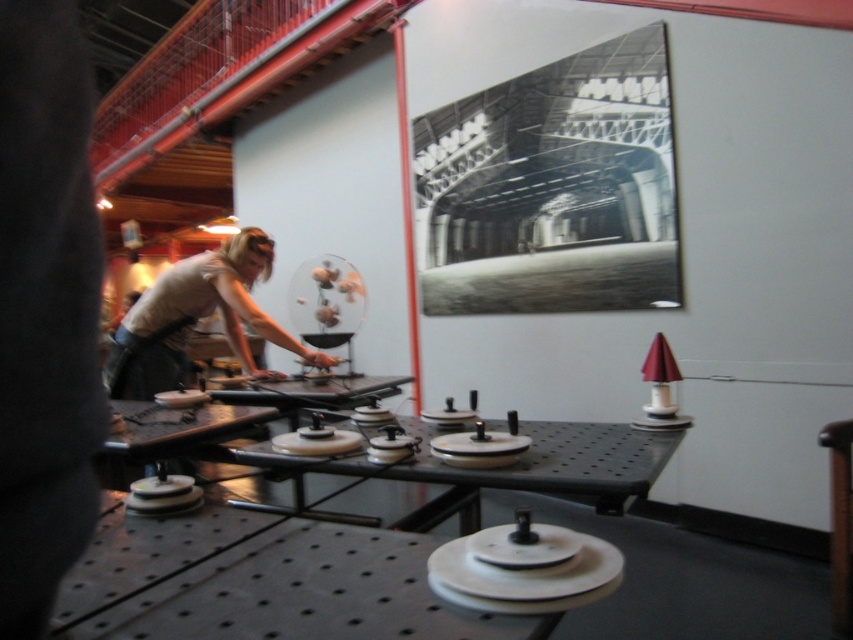
Question: Can you confirm if metallic industrial structure at upper center is bigger than light beige fabric shirt at left?

Choices:
 (A) no
 (B) yes

Answer: (B)

Question: Can you confirm if metallic industrial structure at upper center is positioned to the left of light beige fabric shirt at left?

Choices:
 (A) no
 (B) yes

Answer: (A)

Question: Among these objects, which one is nearest to the camera?

Choices:
 (A) metallic industrial structure at upper center
 (B) light beige fabric shirt at left

Answer: (B)

Question: Considering the relative positions of metallic industrial structure at upper center and light beige fabric shirt at left in the image provided, where is metallic industrial structure at upper center located with respect to light beige fabric shirt at left?

Choices:
 (A) right
 (B) left

Answer: (A)